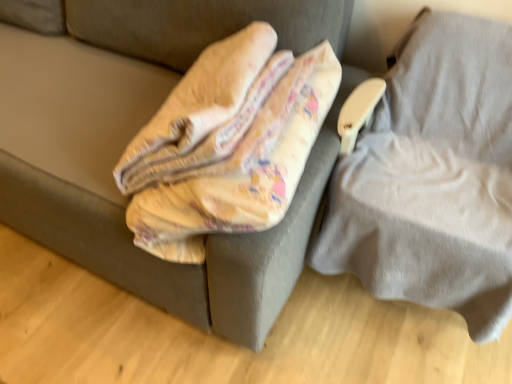
Question: Is yellow fabric blanket at upper left, which is counted as the first furniture, starting from the left, aimed at gray fabric pillow at right, marked as the 2th furniture in a left-to-right arrangement?

Choices:
 (A) yes
 (B) no

Answer: (B)

Question: Are yellow fabric blanket at upper left, which is counted as the first furniture, starting from the left, and gray fabric pillow at right, marked as the 2th furniture in a left-to-right arrangement, beside each other?

Choices:
 (A) no
 (B) yes

Answer: (A)

Question: Is yellow fabric blanket at upper left, which is counted as the first furniture, starting from the left, further to the viewer compared to gray fabric pillow at right, marked as the 2th furniture in a left-to-right arrangement?

Choices:
 (A) no
 (B) yes

Answer: (B)

Question: From the image's perspective, would you say yellow fabric blanket at upper left, the second furniture from the right, is shown under gray fabric pillow at right, which appears as the 1th furniture when viewed from the right?

Choices:
 (A) yes
 (B) no

Answer: (B)

Question: Is yellow fabric blanket at upper left, which is counted as the first furniture, starting from the left, wider than gray fabric pillow at right, marked as the 2th furniture in a left-to-right arrangement?

Choices:
 (A) no
 (B) yes

Answer: (B)

Question: From the image's perspective, is yellow fabric blanket at upper left, the second furniture from the right, on top of gray fabric pillow at right, which appears as the 1th furniture when viewed from the right?

Choices:
 (A) no
 (B) yes

Answer: (B)

Question: Can you confirm if gray fabric pillow at right, which appears as the 1th furniture when viewed from the right, is positioned to the right of yellow fabric blanket at upper left, the second furniture from the right?

Choices:
 (A) no
 (B) yes

Answer: (B)

Question: Considering the relative sizes of gray fabric pillow at right, which appears as the 1th furniture when viewed from the right, and yellow fabric blanket at upper left, which is counted as the first furniture, starting from the left, in the image provided, is gray fabric pillow at right, which appears as the 1th furniture when viewed from the right, smaller than yellow fabric blanket at upper left, which is counted as the first furniture, starting from the left,?

Choices:
 (A) no
 (B) yes

Answer: (A)

Question: Is yellow fabric blanket at upper left, the second furniture from the right, at the back of gray fabric pillow at right, marked as the 2th furniture in a left-to-right arrangement?

Choices:
 (A) yes
 (B) no

Answer: (B)

Question: Is gray fabric pillow at right, which appears as the 1th furniture when viewed from the right, shorter than yellow fabric blanket at upper left, which is counted as the first furniture, starting from the left?

Choices:
 (A) no
 (B) yes

Answer: (A)

Question: From a real-world perspective, is gray fabric pillow at right, marked as the 2th furniture in a left-to-right arrangement, under yellow fabric blanket at upper left, the second furniture from the right?

Choices:
 (A) no
 (B) yes

Answer: (B)

Question: Can you confirm if gray fabric pillow at right, which appears as the 1th furniture when viewed from the right, is bigger than yellow fabric blanket at upper left, the second furniture from the right?

Choices:
 (A) no
 (B) yes

Answer: (B)

Question: From the image's perspective, relative to yellow fabric blanket at upper left, which is counted as the first furniture, starting from the left, is gray fabric pillow at right, which appears as the 1th furniture when viewed from the right, above or below?

Choices:
 (A) below
 (B) above

Answer: (A)